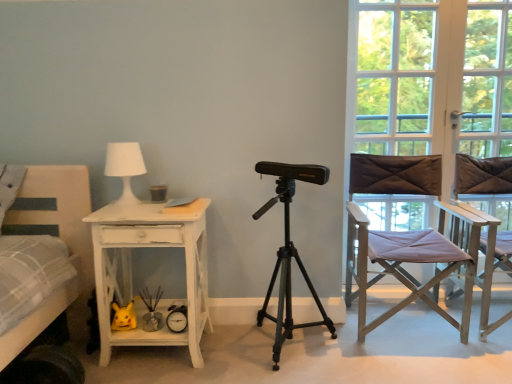
Identify the location of vacant space situated above white distressed wood desk at left (from a real-world perspective). (153, 208).